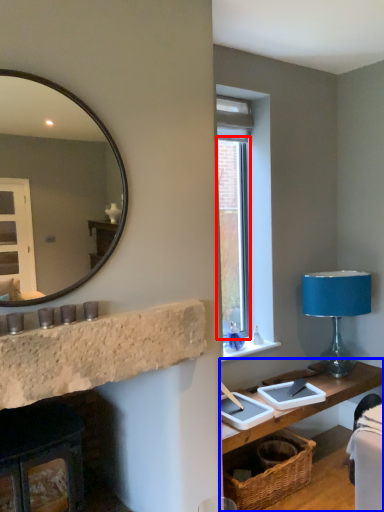
Question: Which of the following is the farthest to the observer, window (highlighted by a red box) or table (highlighted by a blue box)?

Choices:
 (A) window
 (B) table

Answer: (A)